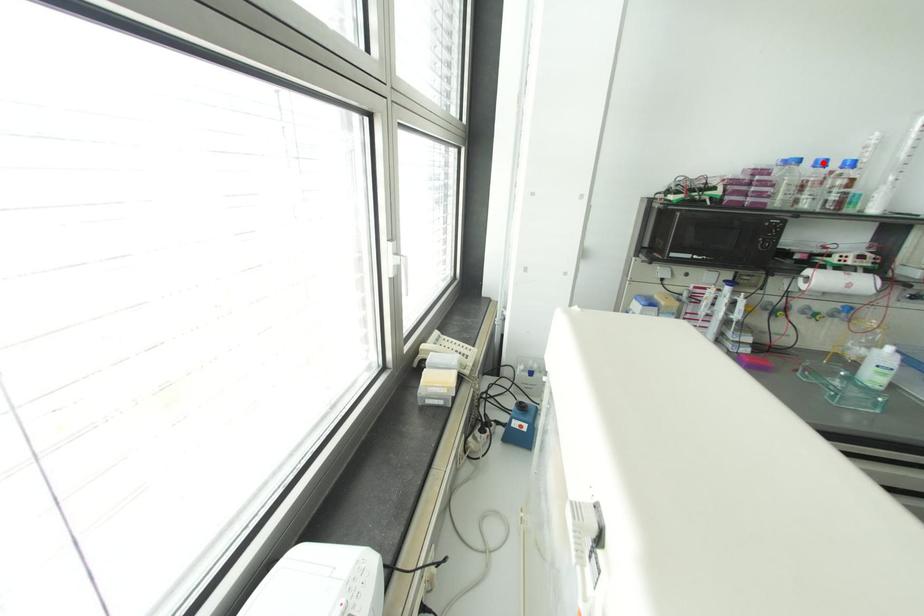
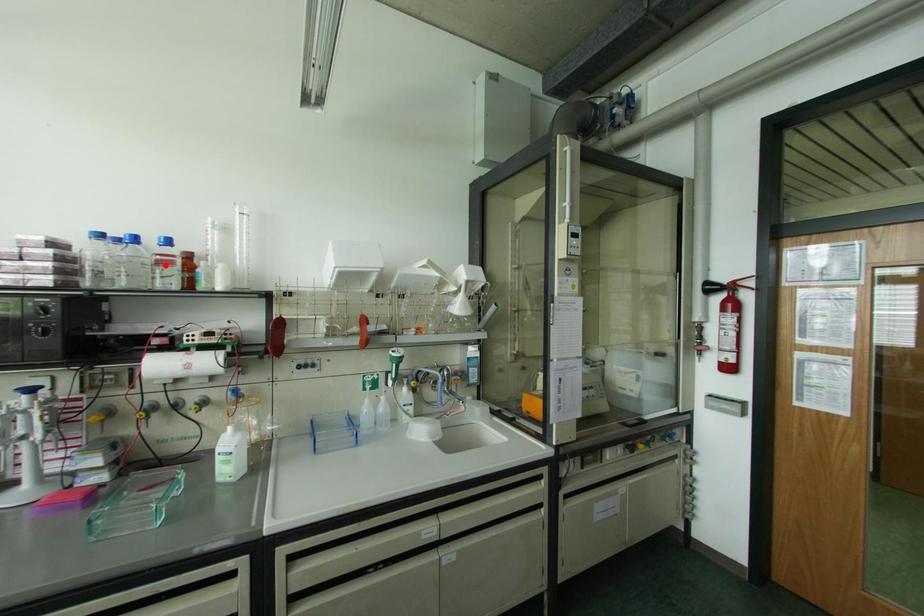
I am providing you with two images of the same scene from different viewpoints. A red point is marked on the first image and another point is marked on the second image. Do the highlighted points in image1 and image2 indicate the same real-world spot?

No